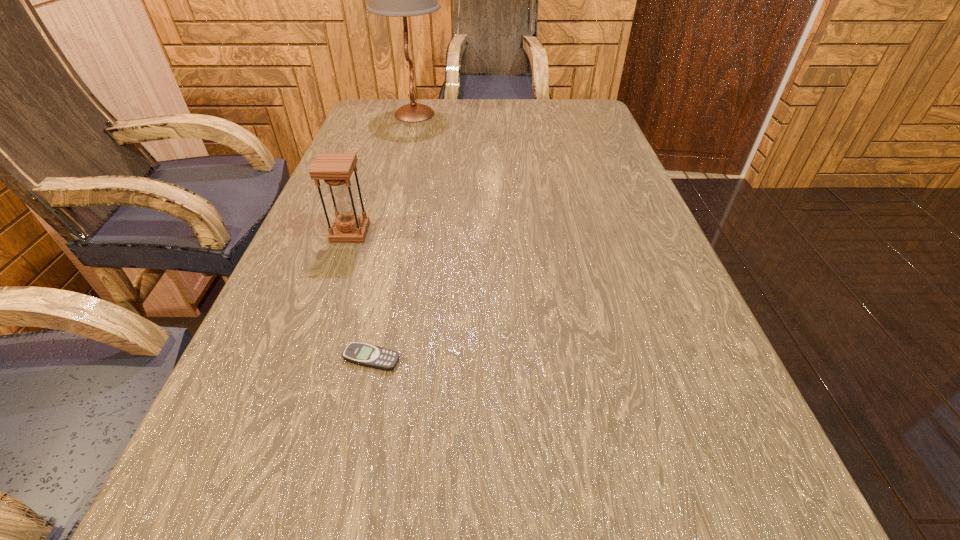
I want to click on vacant region between the farthest object and the shortest object, so click(394, 236).

At what (x,y) coordinates should I click in order to perform the action: click on free space between the hourglass and the farthest object. Please return your answer as a coordinate pair (x, y). Looking at the image, I should click on (382, 173).

Find the location of `empty space between the beeper and the tallest object`. empty space between the beeper and the tallest object is located at coordinates (394, 236).

Image resolution: width=960 pixels, height=540 pixels. Identify the location of blank region between the shortest object and the second tallest object. (361, 295).

This screenshot has height=540, width=960. I want to click on empty space between the tallest object and the second shortest object, so click(x=382, y=173).

Where is `free point between the hourglass and the table lamp`? This screenshot has height=540, width=960. free point between the hourglass and the table lamp is located at coordinates (382, 173).

At what (x,y) coordinates should I click in order to perform the action: click on vacant point located between the beeper and the hourglass. Please return your answer as a coordinate pair (x, y). The image size is (960, 540). Looking at the image, I should click on (361, 295).

You are a GUI agent. You are given a task and a screenshot of the screen. Output one action in this format:
    pyautogui.click(x=<x>, y=<y>)
    Task: Click on the unoccupied position between the beeper and the second shortest object
    This screenshot has height=540, width=960.
    Given the screenshot: What is the action you would take?
    pyautogui.click(x=361, y=295)

Locate an element on the screen. This screenshot has height=540, width=960. vacant area that lies between the nearest object and the farthest object is located at coordinates 394,236.

Where is `object that is the second closest to the nearest object`? The image size is (960, 540). object that is the second closest to the nearest object is located at coordinates (403, 0).